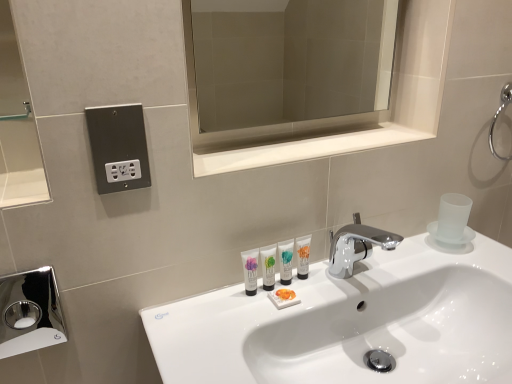
This screenshot has height=384, width=512. I want to click on space that is in front of white glossy tube at center, marked as the second mouthwash in a left-to-right arrangement, so click(244, 332).